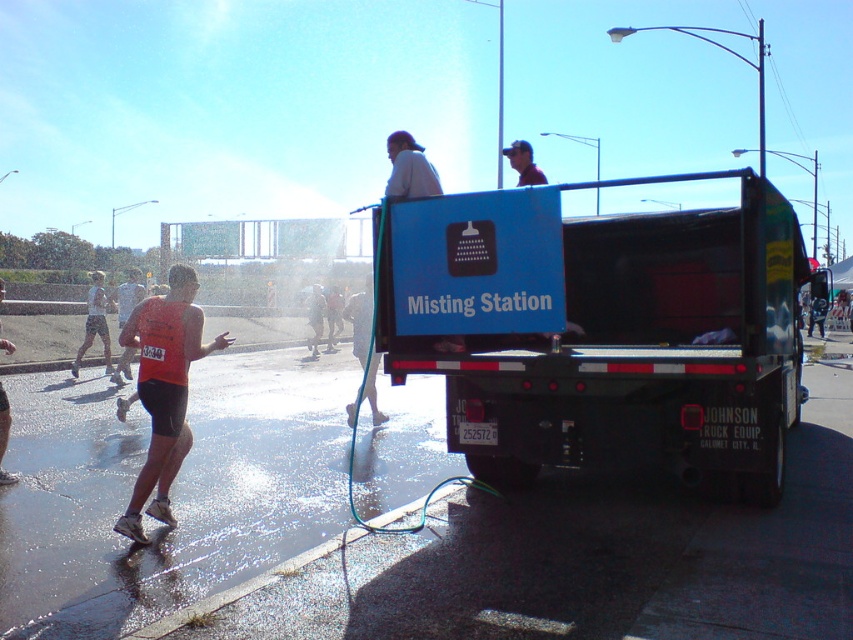
This screenshot has height=640, width=853. Describe the element at coordinates (631, 346) in the screenshot. I see `blue matte truck at upper center` at that location.

Does blue matte truck at upper center have a lesser height compared to orange tank top at left?

No.

Is point (689, 236) farther from camera compared to point (3, 436)?

Yes, point (689, 236) is behind point (3, 436).

Locate an element on the screen. The width and height of the screenshot is (853, 640). blue matte truck at upper center is located at coordinates (631, 346).

Does blue matte truck at upper center appear over white athletic shorts at left?

Incorrect, blue matte truck at upper center is not positioned above white athletic shorts at left.

Where is `blue matte truck at upper center`? This screenshot has height=640, width=853. blue matte truck at upper center is located at coordinates (631, 346).

Which is behind, point (744, 208) or point (91, 273)?

Positioned behind is point (91, 273).

The width and height of the screenshot is (853, 640). Identify the location of blue matte truck at upper center. (631, 346).

Can you confirm if orange fabric shorts at left is positioned to the left of white athletic shorts at left?

Incorrect, orange fabric shorts at left is not on the left side of white athletic shorts at left.

Locate an element on the screen. This screenshot has width=853, height=640. orange fabric shorts at left is located at coordinates (164, 388).

You are a GUI agent. You are given a task and a screenshot of the screen. Output one action in this format:
    pyautogui.click(x=<x>, y=<y>)
    Task: Click on the orange fabric shorts at left
    
    Given the screenshot: What is the action you would take?
    pyautogui.click(x=164, y=388)

Find the location of a particular element. orange fabric shorts at left is located at coordinates (164, 388).